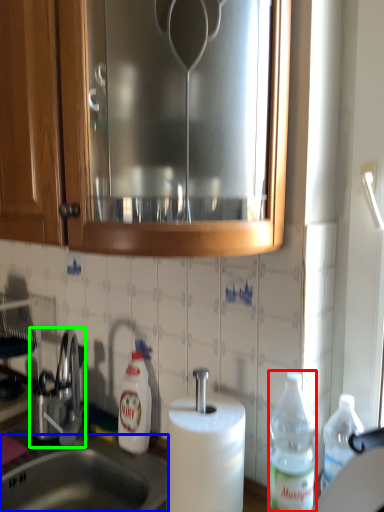
Question: Based on their relative distances, which object is nearer to bottle (highlighted by a red box)? Choose from sink (highlighted by a blue box) and tap (highlighted by a green box).

Choices:
 (A) sink
 (B) tap

Answer: (A)